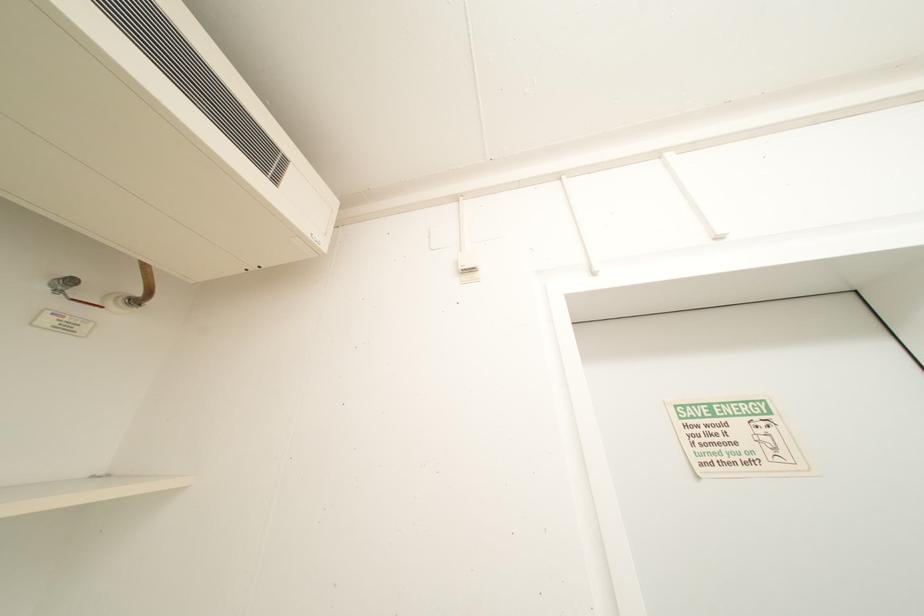
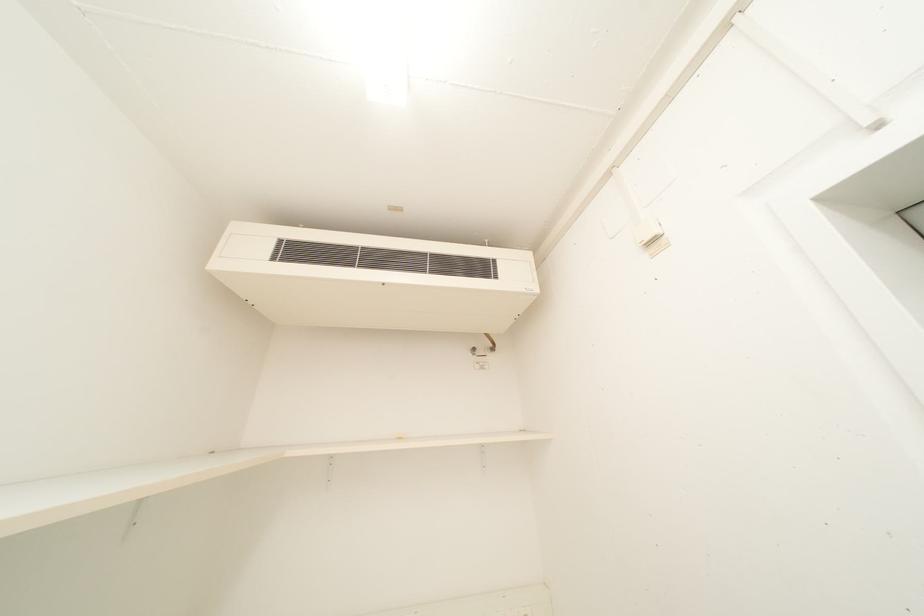
Question: The camera is either moving clockwise (left) or counter-clockwise (right) around the object. The first image is from the beginning of the video and the second image is from the end. Is the camera moving left or right when shooting the video?

Choices:
 (A) Left
 (B) Right

Answer: (B)